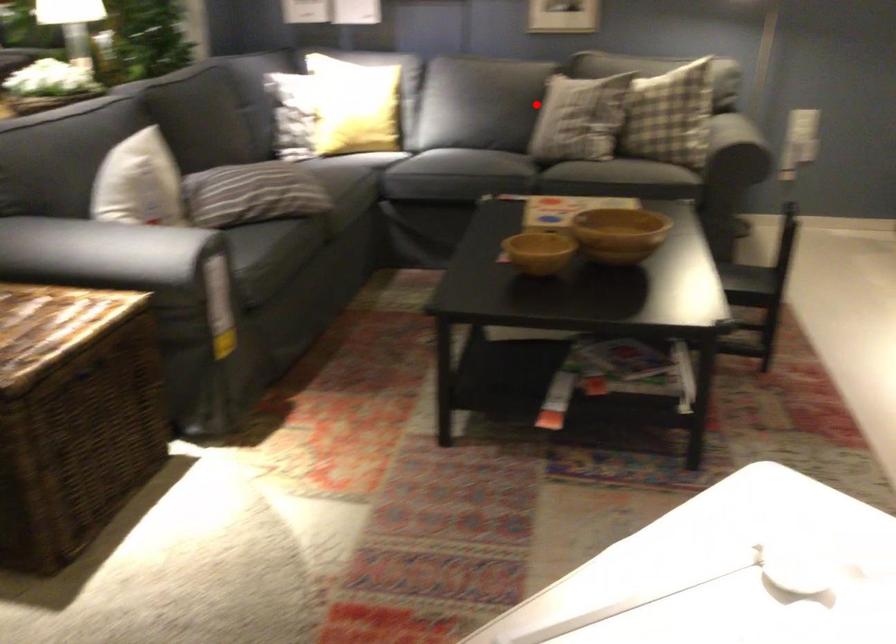
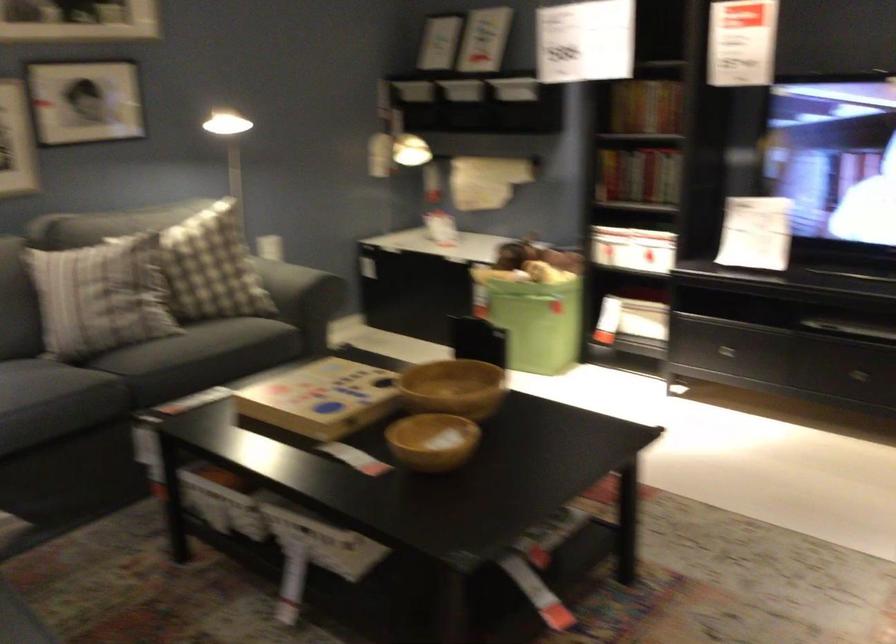
Question: I am providing you with two images of the same scene from different viewpoints. Image1 has a red point marked. In image2, the corresponding 3D location appears at what relative position? Reply with the corresponding letter.

Choices:
 (A) Closer
 (B) Farther

Answer: (A)